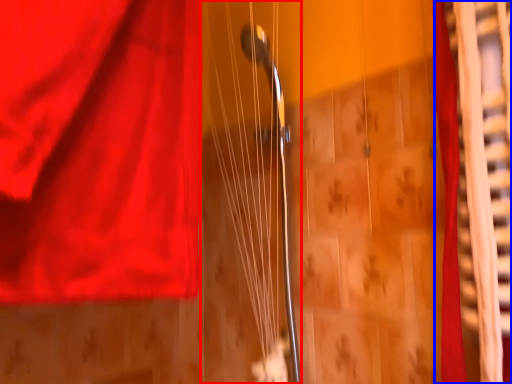
Question: Among these objects, which one is nearest to the camera, string (highlighted by a red box) or curtain (highlighted by a blue box)?

Choices:
 (A) string
 (B) curtain

Answer: (B)